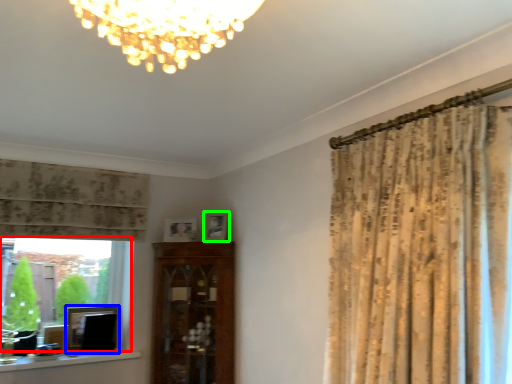
Question: Which object is the farthest from bay window (highlighted by a red box)? Choose among these: picture frame (highlighted by a blue box) or picture frame (highlighted by a green box).

Choices:
 (A) picture frame
 (B) picture frame

Answer: (B)